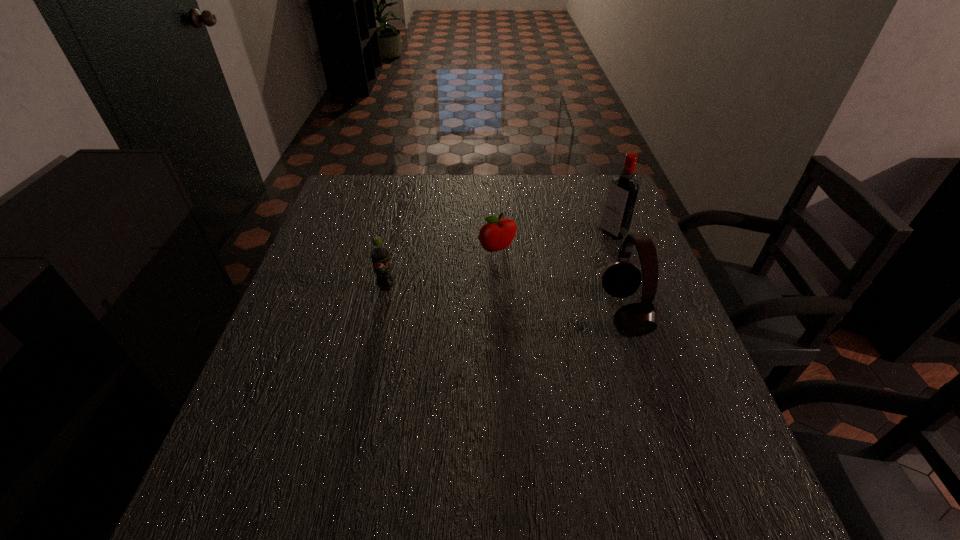
Image resolution: width=960 pixels, height=540 pixels. Find the location of `the leftmost object`. the leftmost object is located at coordinates pyautogui.click(x=379, y=254).

This screenshot has width=960, height=540. Identify the location of soda. (379, 254).

Find the location of `headset`. headset is located at coordinates point(621,278).

Locate an element on the screen. The image size is (960, 540). vodka is located at coordinates (621, 198).

Image resolution: width=960 pixels, height=540 pixels. In order to click on the shortest object in this screenshot , I will do `click(497, 234)`.

The image size is (960, 540). I want to click on the second farthest object, so click(497, 234).

The height and width of the screenshot is (540, 960). Find the location of `vacant space located on the front label of the soda`. vacant space located on the front label of the soda is located at coordinates (359, 410).

The image size is (960, 540). What are the coordinates of `free space located on the ear pads of the second tallest object` in the screenshot? It's located at (475, 312).

Identify the location of vacant space positioned 0.390m on the ear pads of the second tallest object. (437, 312).

Locate an element on the screen. The image size is (960, 540). vacant space located 0.330m on the ear pads of the second tallest object is located at coordinates pos(463,312).